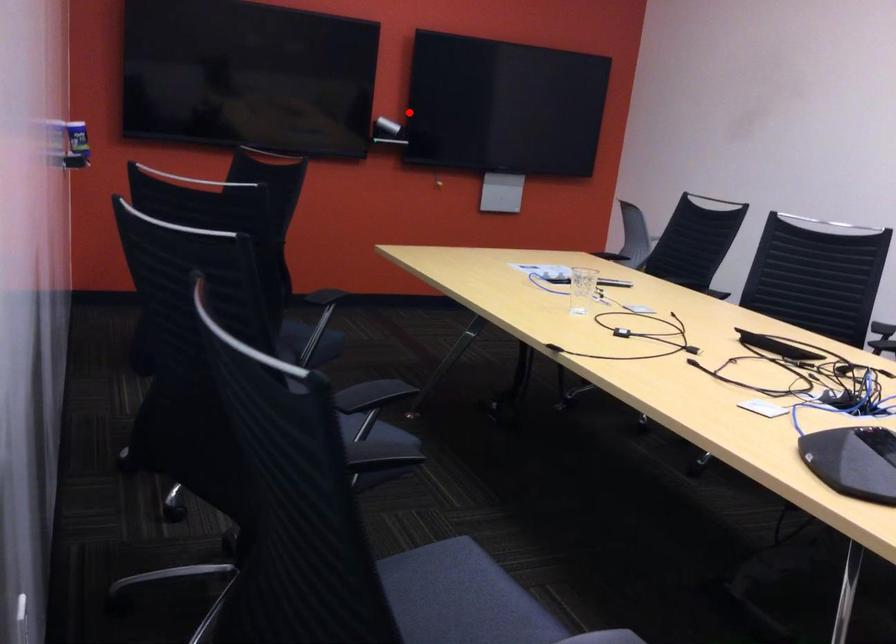
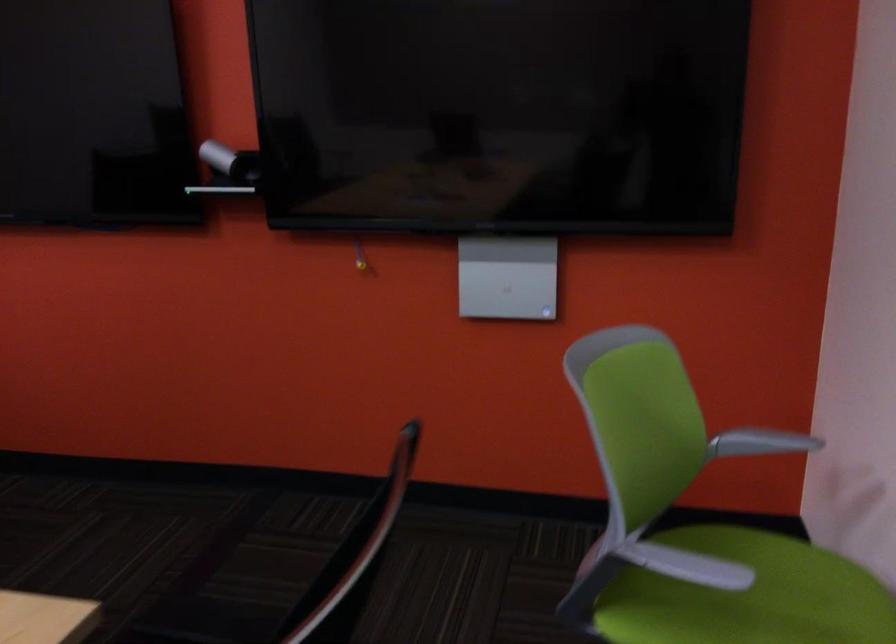
Locate, in the second image, the point that corresponds to the highlighted location in the first image.

(230, 162)